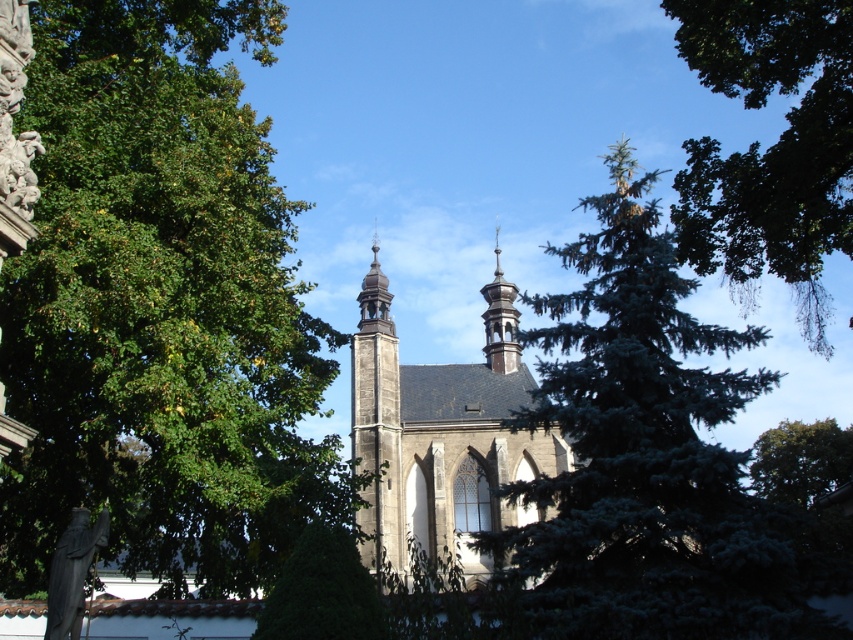
Which is more to the right, green needle-like at center or stone church at center?

Positioned to the right is green needle-like at center.

Is green needle-like at center wider than stone church at center?

Correct, the width of green needle-like at center exceeds that of stone church at center.

Is point (637, 312) farther from camera compared to point (450, 376)?

That is False.

Locate an element on the screen. The height and width of the screenshot is (640, 853). green needle-like at center is located at coordinates (641, 451).

Which is behind, point (135, 161) or point (467, 406)?

The point (467, 406) is behind.

Consider the image. Is green leafy tree at left closer to the viewer compared to stone church at center?

Yes, green leafy tree at left is in front of stone church at center.

Who is more forward, (212, 58) or (534, 509)?

Positioned in front is point (534, 509).

Where is `green leafy tree at left`? This screenshot has height=640, width=853. green leafy tree at left is located at coordinates (160, 307).

Which is below, green leafy tree at left or green needle-like at center?

green needle-like at center is lower down.

Who is positioned more to the right, green leafy tree at left or green needle-like at center?

Positioned to the right is green needle-like at center.

Identify the location of green leafy tree at left. This screenshot has height=640, width=853. (160, 307).